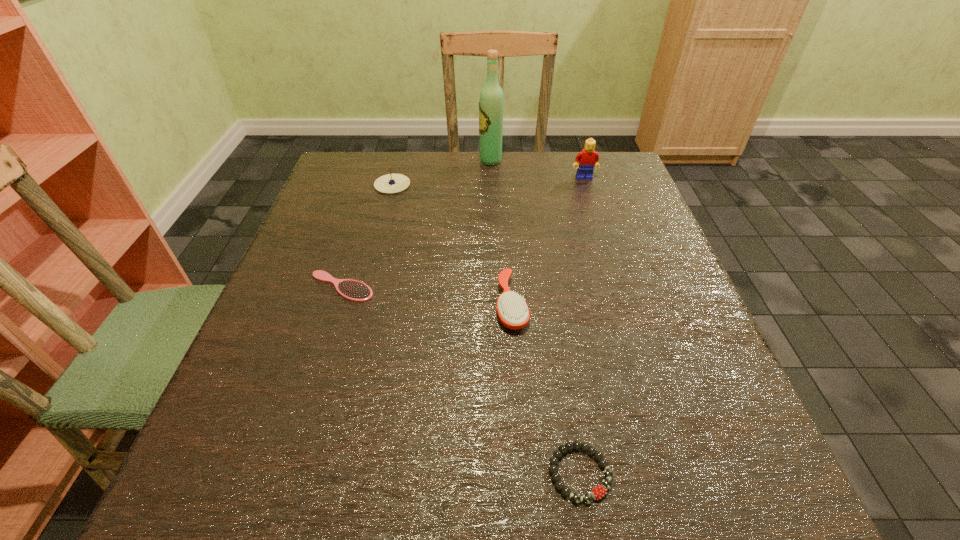
Where is `Lego at the far edge`? Lego at the far edge is located at coordinates [588, 159].

Where is `compass that is at the far edge`? This screenshot has width=960, height=540. compass that is at the far edge is located at coordinates (391, 183).

Where is `object at the near edge`? object at the near edge is located at coordinates (598, 492).

Where is `compass situated at the left edge`? compass situated at the left edge is located at coordinates (391, 183).

At what (x,y) coordinates should I click in order to perform the action: click on hairbrush that is positioned at the left edge. Please return your answer as a coordinate pair (x, y). Looking at the image, I should click on (354, 290).

Locate an element on the screen. The height and width of the screenshot is (540, 960). object positioned at the right edge is located at coordinates (588, 159).

Find the location of a particular element. The width and height of the screenshot is (960, 540). object that is at the far left corner is located at coordinates (391, 183).

I want to click on object that is at the far right corner, so click(588, 159).

At what (x,y) coordinates should I click in order to perform the action: click on free spot at the far edge of the desktop. Please return your answer as a coordinate pair (x, y). Image resolution: width=960 pixels, height=540 pixels. Looking at the image, I should click on (471, 159).

In the image, there is a desktop. Identify the location of blank space at the near edge. The width and height of the screenshot is (960, 540). (473, 484).